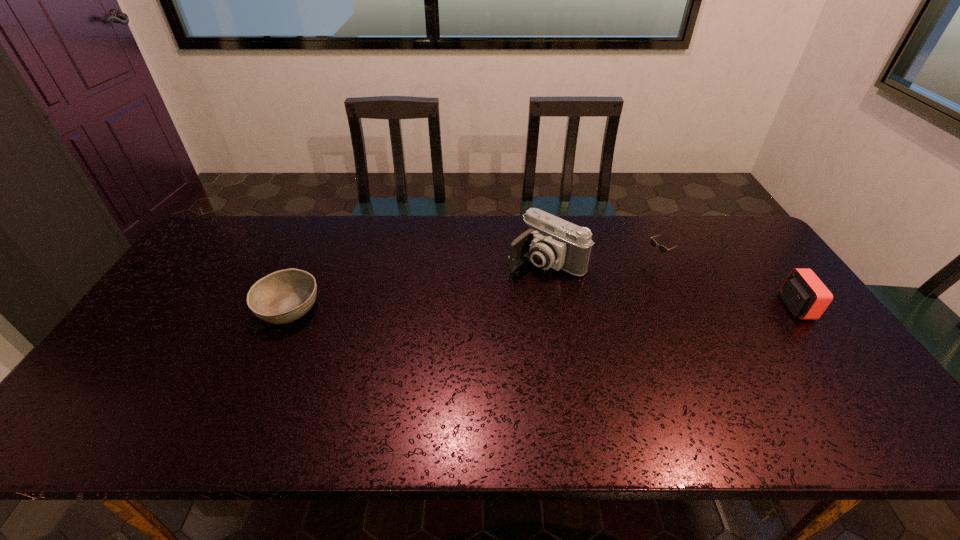
Find the location of a particular element. The height and width of the screenshot is (540, 960). the leftmost object is located at coordinates (284, 296).

Identify the location of alarm clock. (805, 295).

Locate an element on the screen. Image resolution: width=960 pixels, height=540 pixels. the third shortest object is located at coordinates (805, 295).

Where is `the third object from left to right`? Image resolution: width=960 pixels, height=540 pixels. the third object from left to right is located at coordinates (663, 249).

This screenshot has height=540, width=960. Identify the location of the second object from left to right. (548, 241).

Locate an element on the screen. The width and height of the screenshot is (960, 540). the tallest object is located at coordinates (548, 241).

You are a GUI agent. You are given a task and a screenshot of the screen. Output one action in this format:
    pyautogui.click(x=<x>, y=<y>)
    Task: Click on the blank space located 0.310m on the right of the bowl
    The height and width of the screenshot is (540, 960).
    Given the screenshot: What is the action you would take?
    pyautogui.click(x=431, y=309)

This screenshot has width=960, height=540. I want to click on vacant point located 0.100m in front of the lenses of the second object from right to left, so coord(622,280).

The height and width of the screenshot is (540, 960). What are the coordinates of `vacant area situated in front of the lenses of the second object from right to left` in the screenshot? It's located at (597, 292).

Locate an element on the screen. vacant area located in front of the lenses of the second object from right to left is located at coordinates (612, 285).